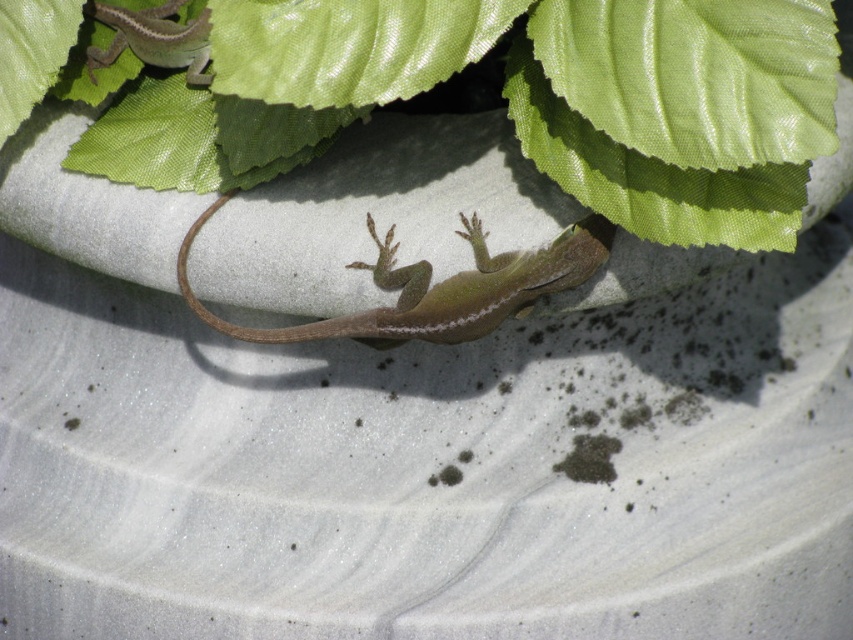
Can you confirm if green glossy leaf at upper center is smaller than brown matte tail at center?

Actually, green glossy leaf at upper center might be larger than brown matte tail at center.

Identify the location of green glossy leaf at upper center. The height and width of the screenshot is (640, 853). (695, 76).

Locate an element on the screen. green glossy leaf at upper center is located at coordinates (695, 76).

Between green matte lizard at center and green matte lizard at upper left, which one appears on the left side from the viewer's perspective?

From the viewer's perspective, green matte lizard at upper left appears more on the left side.

Can you confirm if green matte lizard at center is positioned above green matte lizard at upper left?

Incorrect, green matte lizard at center is not positioned above green matte lizard at upper left.

Does point (467, 234) lie behind point (173, 26)?

No, (467, 234) is in front of (173, 26).

Where is `green matte lizard at center`? Image resolution: width=853 pixels, height=640 pixels. green matte lizard at center is located at coordinates (436, 288).

Measure the distance between point (x=50, y=224) and camera.

Point (x=50, y=224) and camera are 1.41 meters apart from each other.

The width and height of the screenshot is (853, 640). What are the coordinates of `green leafy plant at upper center` in the screenshot? It's located at (84, 241).

This screenshot has height=640, width=853. Identify the location of green leafy plant at upper center. (84, 241).